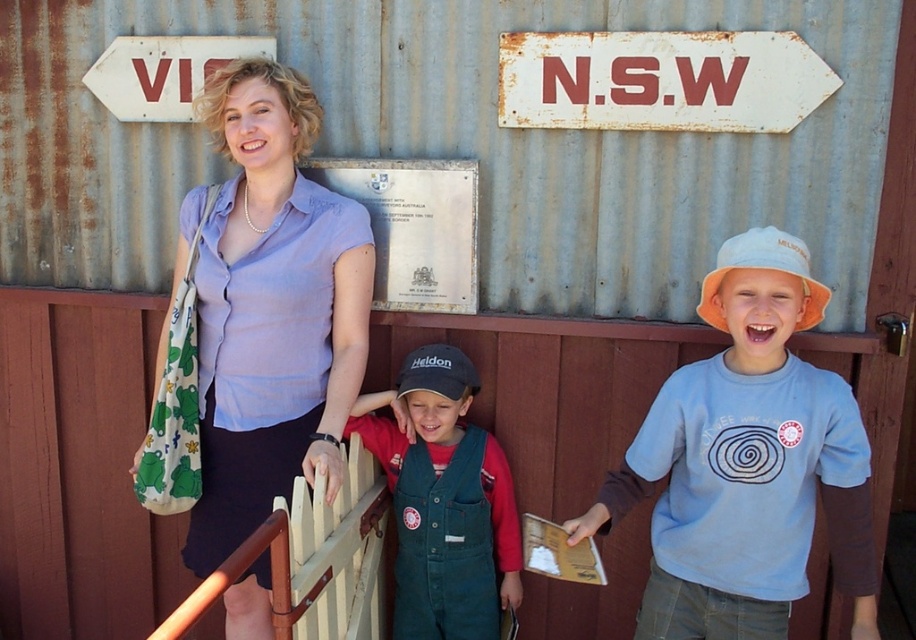
Question: In this image, where is matte purple blouse at center located relative to matte green overalls at center?

Choices:
 (A) below
 (B) above

Answer: (B)

Question: Considering the real-world distances, which object is closest to the matte green overalls at center?

Choices:
 (A) rusty metal sign at upper left
 (B) brown wooden rail at center
 (C) light blue cotton shirt at center
 (D) rusty metal sign at upper center

Answer: (B)

Question: Can you confirm if matte green overalls at center is positioned to the right of rusty metal sign at upper left?

Choices:
 (A) no
 (B) yes

Answer: (B)

Question: Can you confirm if matte green overalls at center is bigger than rusty metal sign at upper center?

Choices:
 (A) no
 (B) yes

Answer: (B)

Question: Based on their relative distances, which object is nearer to the matte purple blouse at center?

Choices:
 (A) rusty metal sign at upper left
 (B) brown wooden rail at center

Answer: (B)

Question: Which object appears farthest from the camera in this image?

Choices:
 (A) rusty metal sign at upper left
 (B) matte purple blouse at center
 (C) brown wooden rail at center

Answer: (A)